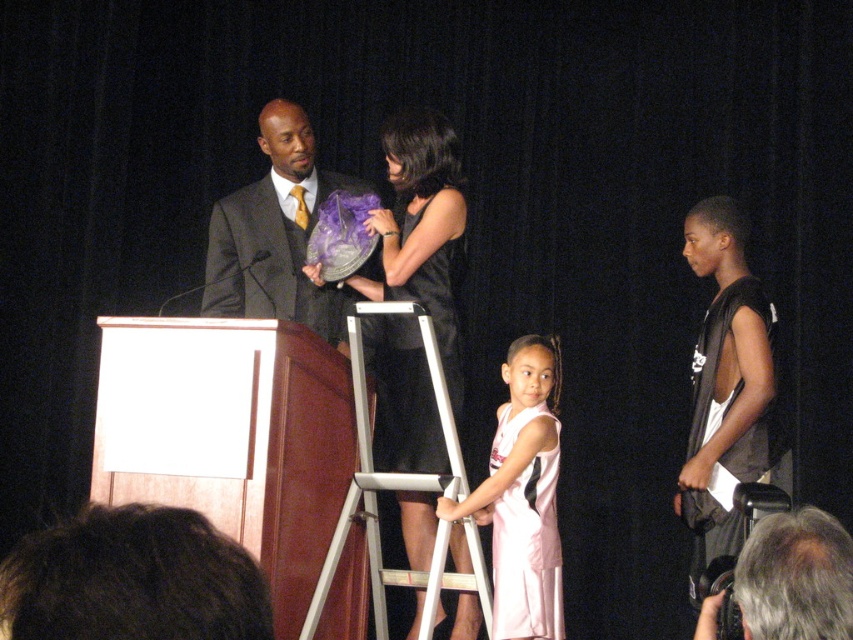
Between point (108, 586) and point (457, 252), which one is positioned in front?

Point (108, 586) is in front.

Can you confirm if dark brown hair at lower left is taller than black satin dress at center?

Incorrect, dark brown hair at lower left's height is not larger of black satin dress at center's.

Does point (138, 589) come behind point (457, 397)?

No.

The image size is (853, 640). What are the coordinates of `dark brown hair at lower left` in the screenshot? It's located at (132, 579).

Does matte black suit at center lie behind white jersey at center?

Yes.

Is matte black suit at center below white jersey at center?

No.

Is point (289, 113) behind point (543, 552)?

That is True.

The width and height of the screenshot is (853, 640). What are the coordinates of `matte black suit at center` in the screenshot? It's located at (276, 234).

Is point (367, 483) closer to camera compared to point (560, 572)?

Yes, it is.

Find the location of a particular element. The height and width of the screenshot is (640, 853). silver metallic ladder at center is located at coordinates (401, 490).

Image resolution: width=853 pixels, height=640 pixels. I want to click on silver metallic ladder at center, so click(x=401, y=490).